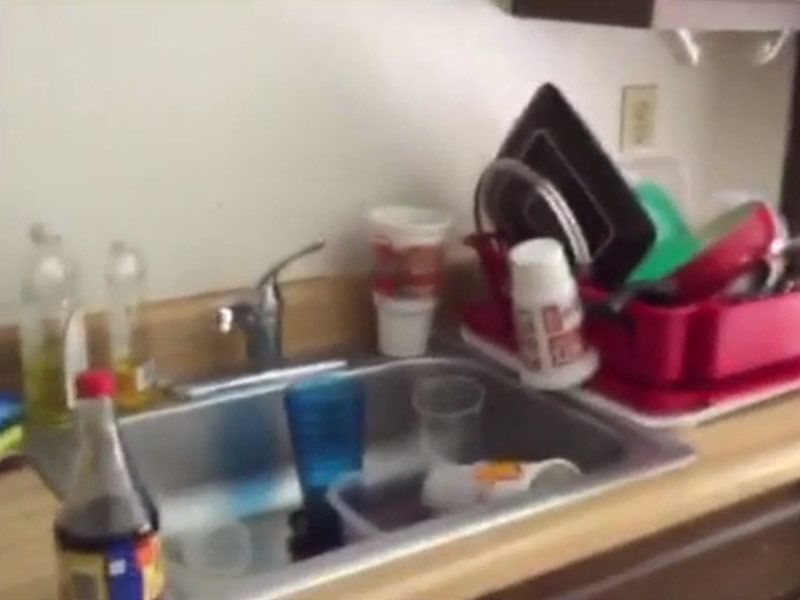
At what (x,y) coordinates should I click in order to perform the action: click on blue cup. Please return your answer as a coordinate pair (x, y). The height and width of the screenshot is (600, 800). Looking at the image, I should click on (326, 436).